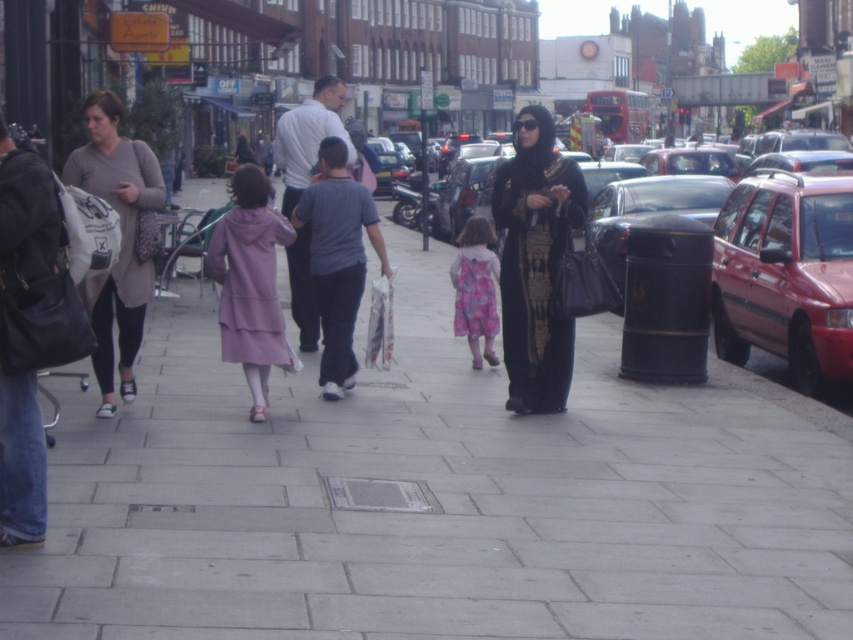
Is black satin abaya at center to the left of pink floral dress at center from the viewer's perspective?

Incorrect, black satin abaya at center is not on the left side of pink floral dress at center.

Is point (537, 362) more distant than point (457, 332)?

No, (537, 362) is in front of (457, 332).

Describe the element at coordinates (535, 262) in the screenshot. I see `black satin abaya at center` at that location.

The image size is (853, 640). What are the coordinates of `black satin abaya at center` in the screenshot? It's located at (535, 262).

Is gray concrete sidewalk at center further to camera compared to metallic red station wagon at right?

No, gray concrete sidewalk at center is closer to the viewer.

Does gray concrete sidewalk at center have a smaller size compared to metallic red station wagon at right?

No.

Is point (712, 464) more distant than point (770, 301)?

No, (712, 464) is closer to viewer.

Locate an element on the screen. gray concrete sidewalk at center is located at coordinates (434, 497).

Is gray concrete sidewalk at center below metallic red car at center right?

Indeed, gray concrete sidewalk at center is positioned under metallic red car at center right.

Between gray concrete sidewalk at center and metallic red car at center right, which one appears on the left side from the viewer's perspective?

Positioned to the left is gray concrete sidewalk at center.

Does point (76, 454) lie behind point (714, 307)?

No, (76, 454) is in front of (714, 307).

The image size is (853, 640). I want to click on gray concrete sidewalk at center, so click(434, 497).